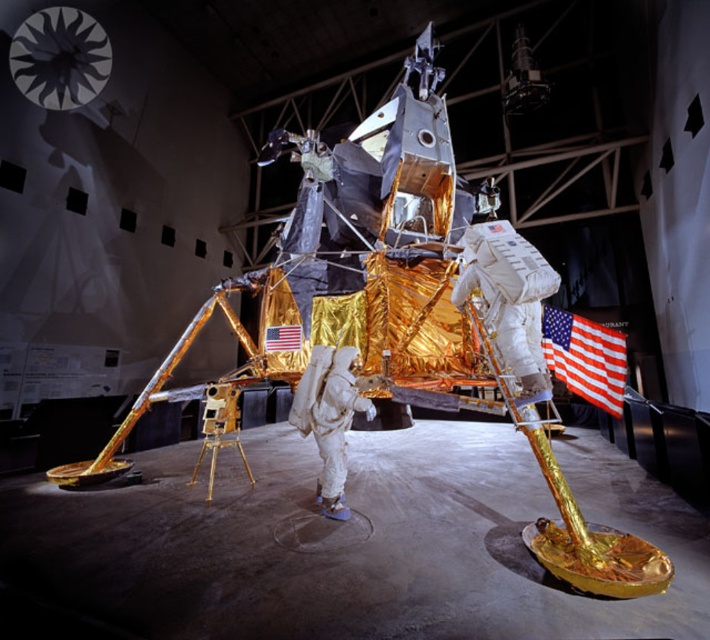
Question: Does gold reflective lunar module at center appear over american flag at center?

Choices:
 (A) no
 (B) yes

Answer: (A)

Question: Considering the real-world distances, which object is closest to the american flag at center?

Choices:
 (A) metallic silver moon at upper left
 (B) white fabric astronaut at center

Answer: (B)

Question: Which of the following is the closest to the observer?

Choices:
 (A) white fabric astronaut at center
 (B) gold reflective lunar module at center

Answer: (B)

Question: Observing the image, what is the correct spatial positioning of gold reflective lunar module at center in reference to white fabric astronaut at center?

Choices:
 (A) left
 (B) right

Answer: (A)

Question: Is metallic silver moon at upper left further to camera compared to american flag at center?

Choices:
 (A) yes
 (B) no

Answer: (A)

Question: Which point appears farthest from the camera in this image?

Choices:
 (A) (342, 476)
 (B) (617, 374)

Answer: (A)